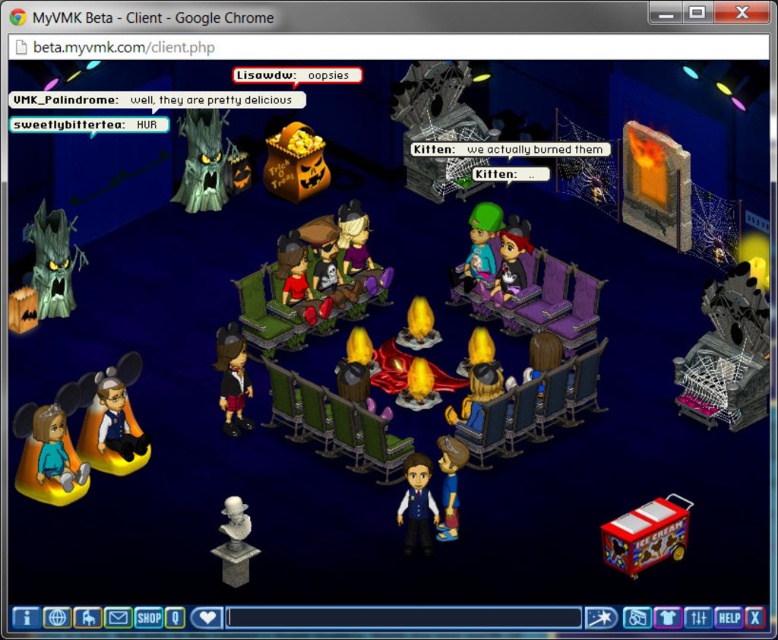
Does point (738, 296) come behind point (492, 262)?

No, it is not.

Who is more forward, [741,333] or [468,284]?

Point [741,333] is in front.

The image size is (778, 640). Describe the element at coordinates (727, 355) in the screenshot. I see `metallic black throne at right` at that location.

At what (x,y) coordinates should I click in order to perform the action: click on metallic black throne at right. Please return your answer as a coordinate pair (x, y). The height and width of the screenshot is (640, 778). Looking at the image, I should click on (727, 355).

Who is more distant from viewer, (228,330) or (482,282)?

The point (482,282) is more distant.

Which of these two, matte black top hat at lower center or green matte plush toy at center, stands taller?

With more height is matte black top hat at lower center.

Where is `matte black top hat at lower center`? Image resolution: width=778 pixels, height=640 pixels. matte black top hat at lower center is located at coordinates click(x=232, y=378).

I want to click on matte black top hat at lower center, so click(x=232, y=378).

Is green matte tree at left closer to the viewer compared to matte black plush at center?

Yes, it is.

Is green matte tree at left bigger than matte black plush at center?

Correct, green matte tree at left is larger in size than matte black plush at center.

Locate an element on the screen. The image size is (778, 640). green matte tree at left is located at coordinates (46, 272).